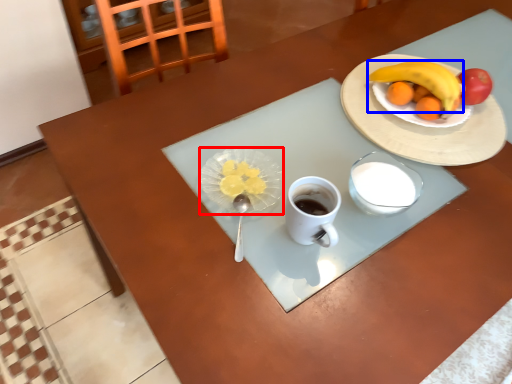
Question: Which of the following is the closest to the observer, tableware (highlighted by a red box) or banana (highlighted by a blue box)?

Choices:
 (A) tableware
 (B) banana

Answer: (A)